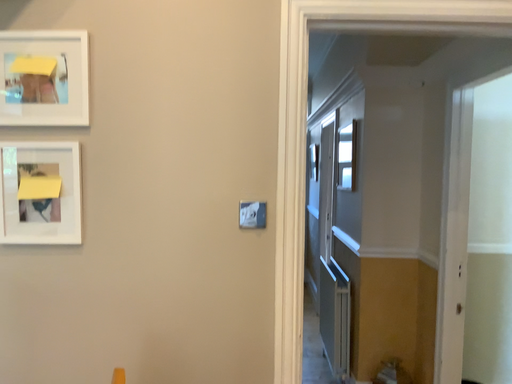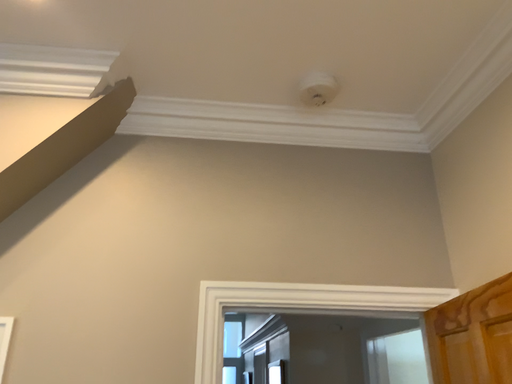
Question: How did the camera likely rotate when shooting the video?

Choices:
 (A) rotated upward
 (B) rotated downward

Answer: (A)